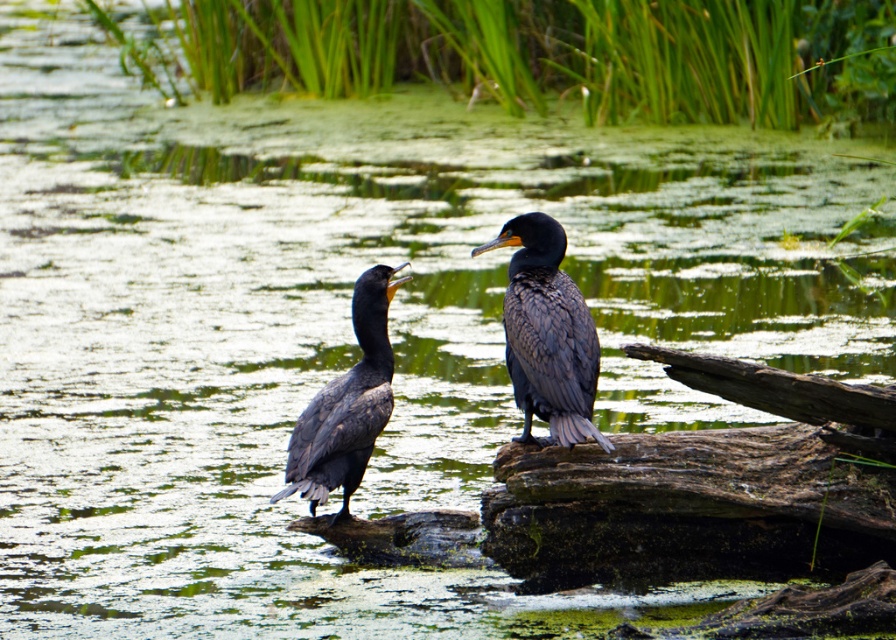
You are a birdwatcher observing the scene. You notice the shiny black cormorant at center and the dark gray feathers at center. Which object is located higher in the image?

The shiny black cormorant at center is positioned over dark gray feathers at center, so it is higher in the image.